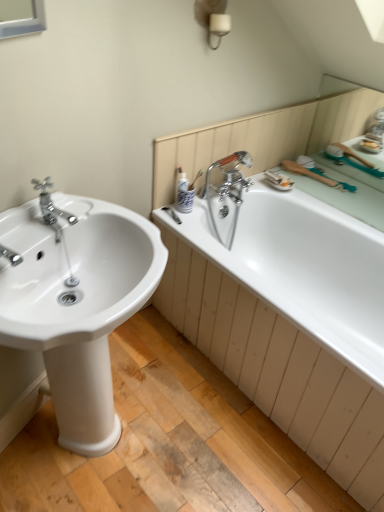
You are a GUI agent. You are given a task and a screenshot of the screen. Output one action in this format:
    pyautogui.click(x=<x>, y=<y>)
    Task: Click on the unoccupied space behind white glossy sink at left
    
    Given the screenshot: What is the action you would take?
    pyautogui.click(x=152, y=347)